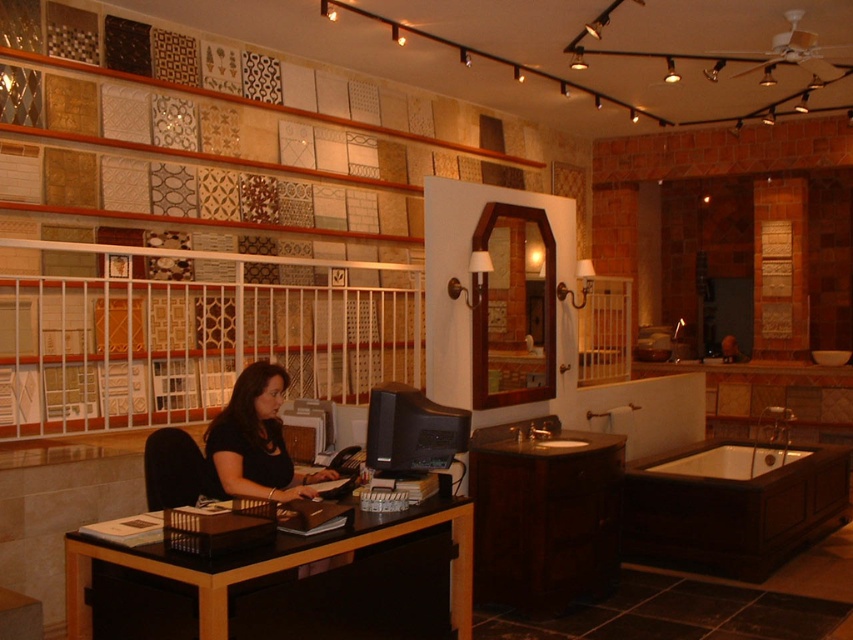
Question: Which object is positioned farthest from the wooden bathtub at lower right?

Choices:
 (A) white glossy bathtub at lower right
 (B) dark wood cabinet at lower center
 (C) black wood desk at center
 (D) matte black monitor at center

Answer: (C)

Question: Is black wood desk at center wider than matte black monitor at center?

Choices:
 (A) yes
 (B) no

Answer: (A)

Question: Which object appears farthest from the camera in this image?

Choices:
 (A) black matte shirt at center
 (B) white glossy bathtub at lower right
 (C) black wood desk at center
 (D) dark wood cabinet at lower center

Answer: (B)

Question: Is the position of black matte shirt at center less distant than that of white glossy bathtub at lower right?

Choices:
 (A) yes
 (B) no

Answer: (A)

Question: Does black wood desk at center appear over matte black monitor at center?

Choices:
 (A) yes
 (B) no

Answer: (B)

Question: Which of the following is the closest to the observer?

Choices:
 (A) matte black monitor at center
 (B) black matte shirt at center
 (C) black wood desk at center
 (D) white glossy bathtub at lower right

Answer: (C)